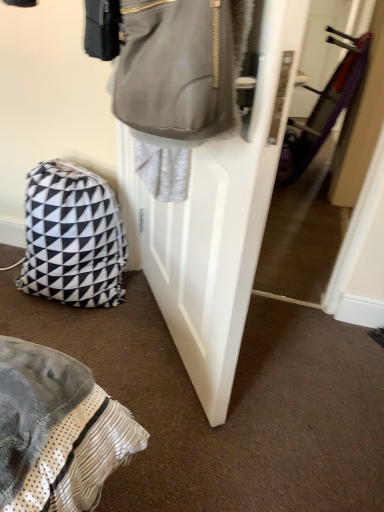
Question: Is black and white geometric fabric backpack at lower left a part of matte gray door at center?

Choices:
 (A) yes
 (B) no

Answer: (B)

Question: Does matte gray door at center have a larger size compared to black and white geometric fabric backpack at lower left?

Choices:
 (A) no
 (B) yes

Answer: (B)

Question: From a real-world perspective, is matte gray door at center on black and white geometric fabric backpack at lower left?

Choices:
 (A) no
 (B) yes

Answer: (B)

Question: Is matte gray door at center smaller than black and white geometric fabric backpack at lower left?

Choices:
 (A) yes
 (B) no

Answer: (B)

Question: Could you tell me if matte gray door at center is turned towards black and white geometric fabric backpack at lower left?

Choices:
 (A) no
 (B) yes

Answer: (A)

Question: Is matte gray door at center at the right side of black and white geometric fabric backpack at lower left?

Choices:
 (A) no
 (B) yes

Answer: (B)

Question: Considering the relative positions of black and white geometric fabric backpack at lower left and matte gray door at center in the image provided, is black and white geometric fabric backpack at lower left to the left of matte gray door at center from the viewer's perspective?

Choices:
 (A) yes
 (B) no

Answer: (A)

Question: Does black and white geometric fabric backpack at lower left turn towards matte gray door at center?

Choices:
 (A) yes
 (B) no

Answer: (B)

Question: Does black and white geometric fabric backpack at lower left touch matte gray door at center?

Choices:
 (A) no
 (B) yes

Answer: (A)

Question: Can you confirm if black and white geometric fabric backpack at lower left is shorter than matte gray door at center?

Choices:
 (A) no
 (B) yes

Answer: (B)

Question: Considering the relative sizes of black and white geometric fabric backpack at lower left and matte gray door at center in the image provided, is black and white geometric fabric backpack at lower left wider than matte gray door at center?

Choices:
 (A) yes
 (B) no

Answer: (A)

Question: Does black and white geometric fabric backpack at lower left come in front of matte gray door at center?

Choices:
 (A) yes
 (B) no

Answer: (B)

Question: In the image, is black and white geometric fabric backpack at lower left positioned in front of or behind matte gray door at center?

Choices:
 (A) behind
 (B) front

Answer: (A)